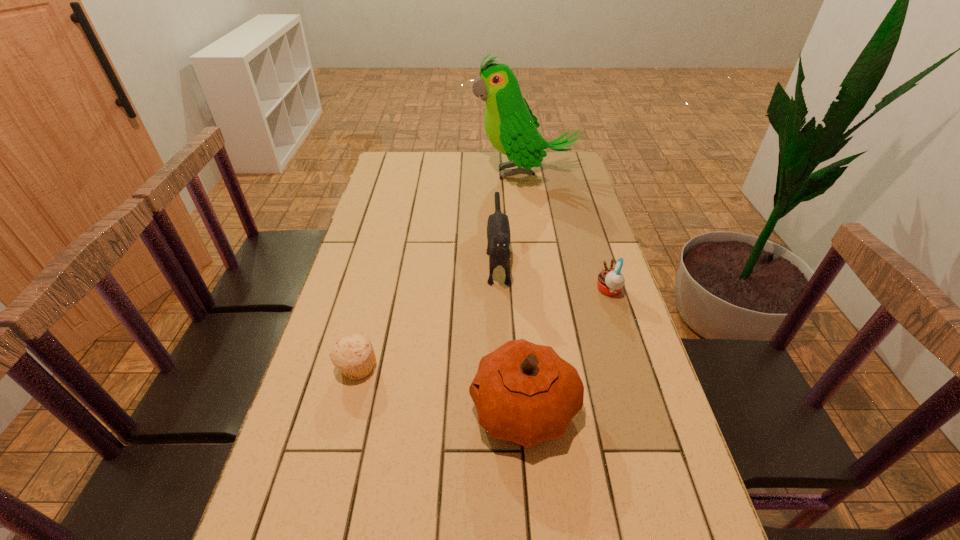
Where is `vacant space located on the front-facing side of the cat`? This screenshot has height=540, width=960. vacant space located on the front-facing side of the cat is located at coordinates (504, 394).

Where is `free space located on the front-facing side of the pumpkin`? free space located on the front-facing side of the pumpkin is located at coordinates tap(314, 409).

Locate an element on the screen. The width and height of the screenshot is (960, 540). free space located 0.140m on the front-facing side of the pumpkin is located at coordinates (408, 409).

I want to click on vacant area situated 0.330m on the front-facing side of the pumpkin, so click(324, 409).

Find the location of a particular element. The image size is (960, 540). vacant space situated on the front-facing side of the right muffin is located at coordinates (544, 291).

At what (x,y) coordinates should I click in order to perform the action: click on free space located 0.100m on the front-facing side of the right muffin. Please return your answer as a coordinate pair (x, y). Looking at the image, I should click on (562, 291).

At what (x,y) coordinates should I click in order to perform the action: click on vacant space located 0.100m on the front-facing side of the right muffin. Please return your answer as a coordinate pair (x, y). Looking at the image, I should click on (562, 291).

This screenshot has width=960, height=540. Identify the location of blank area located on the right of the leftmost object. (450, 368).

Where is `object situated at the far edge`? Image resolution: width=960 pixels, height=540 pixels. object situated at the far edge is located at coordinates (511, 127).

Identify the location of object that is positioned at the left edge. (354, 355).